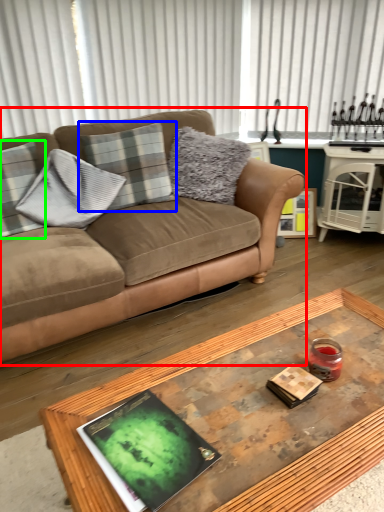
Question: Estimate the real-world distances between objects in this image. Which object is farther from studio couch (highlighted by a red box), pillow (highlighted by a blue box) or pillow (highlighted by a green box)?

Choices:
 (A) pillow
 (B) pillow

Answer: (B)